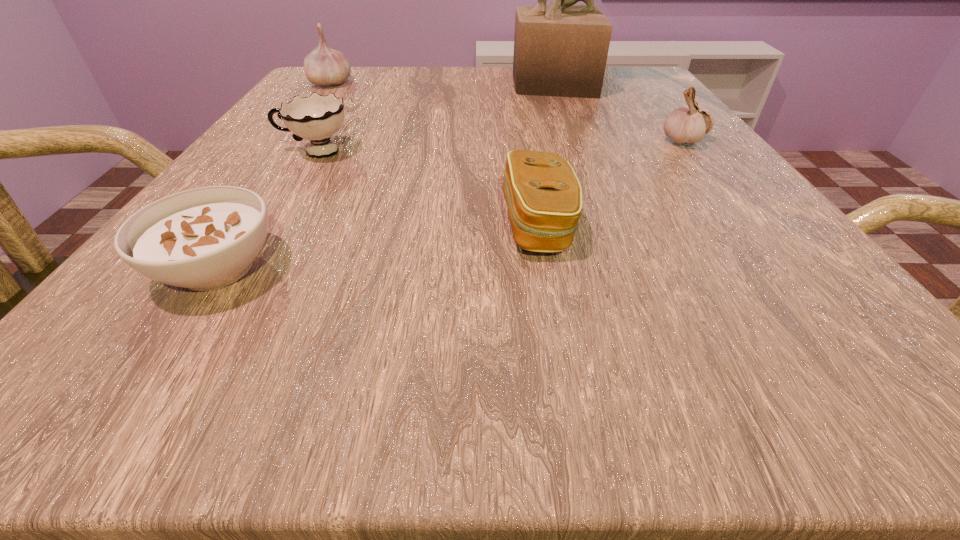
This screenshot has height=540, width=960. What are the coordinates of `cup that is positioned at the left edge` in the screenshot? It's located at (316, 118).

Find the location of `soup bowl at the left edge`. soup bowl at the left edge is located at coordinates (202, 239).

This screenshot has height=540, width=960. In order to click on sculpture at the right edge in this screenshot , I will do `click(561, 50)`.

Locate an element on the screen. The width and height of the screenshot is (960, 540). garlic that is at the right edge is located at coordinates (684, 125).

Find the location of a particular element. The image size is (960, 540). object present at the far left corner is located at coordinates (324, 66).

Find the location of a particular element. The width and height of the screenshot is (960, 540). object situated at the far right corner is located at coordinates (561, 50).

Find the location of a particular element. Image resolution: width=960 pixels, height=540 pixels. vacant space at the far edge of the desktop is located at coordinates (452, 74).

Image resolution: width=960 pixels, height=540 pixels. Find the location of `vacant area at the left edge`. vacant area at the left edge is located at coordinates (250, 165).

Find the location of a particular element. free spot at the right edge of the desktop is located at coordinates (661, 156).

Identify the location of vacant space at the far right corner of the desktop. Image resolution: width=960 pixels, height=540 pixels. (628, 85).